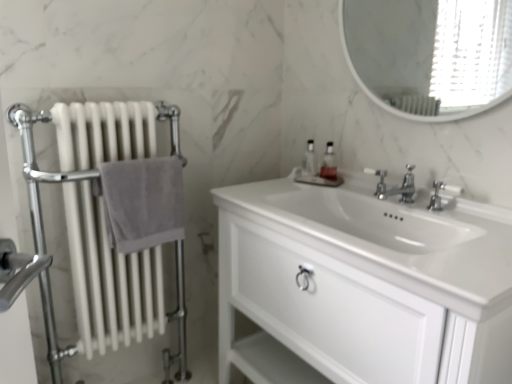
This screenshot has height=384, width=512. Describe the element at coordinates (309, 159) in the screenshot. I see `translucent glass soap dispenser at center, which appears as the 2th soap dispenser when viewed from the right` at that location.

What are the coordinates of `polished chrome faucet at center, the 1th tap viewed from the right` in the screenshot? It's located at (439, 195).

Measure the distance between point (108,174) and camera.

Point (108,174) and camera are 1.31 meters apart.

Where is `translucent glass soap dispenser at center, placed as the 1th soap dispenser when sorted from left to right`? translucent glass soap dispenser at center, placed as the 1th soap dispenser when sorted from left to right is located at coordinates (309, 159).

This screenshot has height=384, width=512. Find the location of `tap on the left side of polished chrome faucet at center, acting as the second tap starting from the left`. tap on the left side of polished chrome faucet at center, acting as the second tap starting from the left is located at coordinates (395, 188).

Is chrome metallic faucet at center, arranged as the second tap when viewed from the right, far away from polished chrome faucet at center, acting as the second tap starting from the left?

That's not correct — chrome metallic faucet at center, arranged as the second tap when viewed from the right, is a little close to polished chrome faucet at center, acting as the second tap starting from the left.

Is chrome metallic faucet at center, arranged as the second tap when viewed from the right, to the left or to the right of polished chrome faucet at center, acting as the second tap starting from the left, in the image?

Based on their positions, chrome metallic faucet at center, arranged as the second tap when viewed from the right, is located to the left of polished chrome faucet at center, acting as the second tap starting from the left.

From the image's perspective, is white glossy cabinet at center under white glossy mirror at upper center?

Yes.

Can you confirm if white glossy cabinet at center is positioned to the right of white glossy mirror at upper center?

No, white glossy cabinet at center is not to the right of white glossy mirror at upper center.

Is white glossy cabinet at center positioned with its back to white glossy mirror at upper center?

No, white glossy cabinet at center is not facing the opposite direction of white glossy mirror at upper center.

Considering the points (337, 220) and (365, 18), which point is in front, point (337, 220) or point (365, 18)?

The point (337, 220) is more forward.

Considering the relative sizes of polished chrome faucet at center, acting as the second tap starting from the left, and gray cotton towel at left in the image provided, is polished chrome faucet at center, acting as the second tap starting from the left, shorter than gray cotton towel at left?

Correct, polished chrome faucet at center, acting as the second tap starting from the left, is not as tall as gray cotton towel at left.

Where is `the 2nd tap to the right of the gray cotton towel at left, starting your count from the anchor`? The image size is (512, 384). the 2nd tap to the right of the gray cotton towel at left, starting your count from the anchor is located at coordinates (439, 195).

How different are the orientations of polished chrome faucet at center, acting as the second tap starting from the left, and gray cotton towel at left in degrees?

The facing directions of polished chrome faucet at center, acting as the second tap starting from the left, and gray cotton towel at left are 91 degrees apart.

From the image's perspective, which one is positioned lower, polished chrome faucet at center, the 1th tap viewed from the right, or gray cotton towel at left?

gray cotton towel at left.

Between point (444, 60) and point (105, 150), which one is positioned in front?

The point (105, 150) is closer to the camera.

Consider the image. How many degrees apart are the facing directions of white glossy mirror at upper center and white metal radiator at left?

The angle between the facing direction of white glossy mirror at upper center and the facing direction of white metal radiator at left is 91.1 degrees.

Can we say white glossy mirror at upper center lies outside white metal radiator at left?

That's correct, white glossy mirror at upper center is outside of white metal radiator at left.

Between white glossy mirror at upper center and white metal radiator at left, which one has smaller width?

white glossy mirror at upper center.

Which object is thinner, white metal radiator at left or polished chrome faucet at center, the 1th tap viewed from the right?

With smaller width is polished chrome faucet at center, the 1th tap viewed from the right.

From a real-world perspective, is white metal radiator at left located higher than polished chrome faucet at center, acting as the second tap starting from the left?

Incorrect, from a real-world perspective, white metal radiator at left is lower than polished chrome faucet at center, acting as the second tap starting from the left.

From their relative heights in the image, would you say white metal radiator at left is taller or shorter than polished chrome faucet at center, the 1th tap viewed from the right?

Considering their sizes, white metal radiator at left has more height than polished chrome faucet at center, the 1th tap viewed from the right.

Could you measure the distance between white metal radiator at left and polished chrome faucet at center, the 1th tap viewed from the right?

white metal radiator at left and polished chrome faucet at center, the 1th tap viewed from the right, are 1.09 meters apart.

In the scene shown: Considering the relative positions of polished chrome faucet at center and chrome metallic faucet at center, arranged as the second tap when viewed from the right, in the image provided, is polished chrome faucet at center behind chrome metallic faucet at center, arranged as the second tap when viewed from the right,?

Yes, polished chrome faucet at center is behind chrome metallic faucet at center, arranged as the second tap when viewed from the right.

Considering the sizes of polished chrome faucet at center and chrome metallic faucet at center, which is counted as the first tap, starting from the left, in the image, is polished chrome faucet at center wider or thinner than chrome metallic faucet at center, which is counted as the first tap, starting from the left,?

Clearly, polished chrome faucet at center has less width compared to chrome metallic faucet at center, which is counted as the first tap, starting from the left.

Is polished chrome faucet at center oriented towards chrome metallic faucet at center, which is counted as the first tap, starting from the left?

No, polished chrome faucet at center is not turned towards chrome metallic faucet at center, which is counted as the first tap, starting from the left.

Which of these two, polished chrome faucet at center or chrome metallic faucet at center, which is counted as the first tap, starting from the left, is smaller?

Smaller between the two is polished chrome faucet at center.

Which object is closer to the camera, translucent plastic soap dispenser at center, the first soap dispenser in the right-to-left sequence, or gray cotton towel at left?

gray cotton towel at left is closer to the camera.

Is translucent plastic soap dispenser at center, the 2th soap dispenser when ordered from left to right, completely or partially outside of gray cotton towel at left?

Yes, translucent plastic soap dispenser at center, the 2th soap dispenser when ordered from left to right, is outside of gray cotton towel at left.

This screenshot has height=384, width=512. I want to click on bath towel that appears below the translucent plastic soap dispenser at center, the first soap dispenser in the right-to-left sequence (from a real-world perspective), so click(x=142, y=202).

From the image's perspective, does translucent plastic soap dispenser at center, the first soap dispenser in the right-to-left sequence, appear lower than gray cotton towel at left?

Incorrect, from the image's perspective, translucent plastic soap dispenser at center, the first soap dispenser in the right-to-left sequence, is higher than gray cotton towel at left.

The height and width of the screenshot is (384, 512). In order to click on tap below the chrome metallic faucet at center, which is counted as the first tap, starting from the left (from the image's perspective) in this screenshot , I will do `click(439, 195)`.

Find the location of a particular element. This screenshot has height=384, width=512. mirror on the right of white glossy cabinet at center is located at coordinates (430, 55).

Which object lies further to the anchor point chrome metallic faucet at center, which is counted as the first tap, starting from the left, white glossy cabinet at center or translucent plastic soap dispenser at center, the 2th soap dispenser when ordered from left to right?

white glossy cabinet at center lies further to chrome metallic faucet at center, which is counted as the first tap, starting from the left, than the other object.

When comparing their distances from translucent plastic soap dispenser at center, the first soap dispenser in the right-to-left sequence, does white glossy mirror at upper center or translucent glass soap dispenser at center, which appears as the 2th soap dispenser when viewed from the right, seem further?

Among the two, white glossy mirror at upper center is located further to translucent plastic soap dispenser at center, the first soap dispenser in the right-to-left sequence.

Looking at the image, which one is located further to white glossy cabinet at center, translucent glass soap dispenser at center, which appears as the 2th soap dispenser when viewed from the right, or white glossy mirror at upper center?

The object further to white glossy cabinet at center is white glossy mirror at upper center.

Based on their spatial positions, is chrome metallic faucet at center, arranged as the second tap when viewed from the right, or white glossy cabinet at center further from translucent glass soap dispenser at center, placed as the 1th soap dispenser when sorted from left to right?

white glossy cabinet at center.

Considering their positions, is white glossy cabinet at center positioned closer to gray cotton towel at left than white metal radiator at left?

Based on the image, white metal radiator at left appears to be nearer to gray cotton towel at left.

From the image, which object appears to be farther from white metal radiator at left, polished chrome faucet at center, the 1th tap viewed from the right, or gray cotton towel at left?

Among the two, polished chrome faucet at center, the 1th tap viewed from the right, is located further to white metal radiator at left.

From the image, which object appears to be nearer to white metal radiator at left, chrome metallic faucet at center, arranged as the second tap when viewed from the right, or polished chrome faucet at center, the 1th tap viewed from the right?

chrome metallic faucet at center, arranged as the second tap when viewed from the right, is closer to white metal radiator at left.

Estimate the real-world distances between objects in this image. Which object is further from polished chrome faucet at center, white glossy mirror at upper center or polished chrome faucet at center, the 1th tap viewed from the right?

The object further to polished chrome faucet at center is white glossy mirror at upper center.

The image size is (512, 384). Find the location of `tap between gray cotton towel at left and polished chrome faucet at center, acting as the second tap starting from the left, in the horizontal direction`. tap between gray cotton towel at left and polished chrome faucet at center, acting as the second tap starting from the left, in the horizontal direction is located at coordinates (395, 188).

Find the location of `plumbing fixture between white glossy mirror at upper center and chrome metallic faucet at center, which is counted as the first tap, starting from the left, from top to bottom`. plumbing fixture between white glossy mirror at upper center and chrome metallic faucet at center, which is counted as the first tap, starting from the left, from top to bottom is located at coordinates (379, 182).

At what (x,y) coordinates should I click in order to perform the action: click on plumbing fixture positioned between white glossy cabinet at center and translucent glass soap dispenser at center, placed as the 1th soap dispenser when sorted from left to right, from near to far. Please return your answer as a coordinate pair (x, y). Image resolution: width=512 pixels, height=384 pixels. Looking at the image, I should click on (379, 182).

At what (x,y) coordinates should I click in order to perform the action: click on soap dispenser situated between gray cotton towel at left and translucent plastic soap dispenser at center, the first soap dispenser in the right-to-left sequence, from left to right. Please return your answer as a coordinate pair (x, y). The width and height of the screenshot is (512, 384). Looking at the image, I should click on (309, 159).